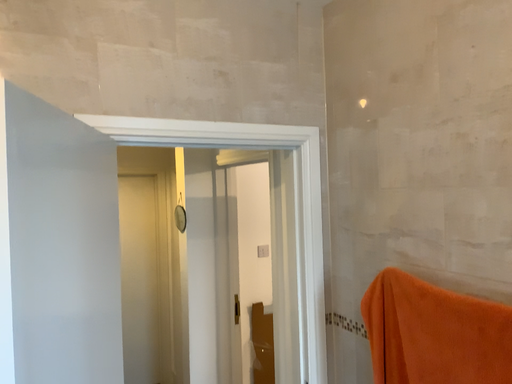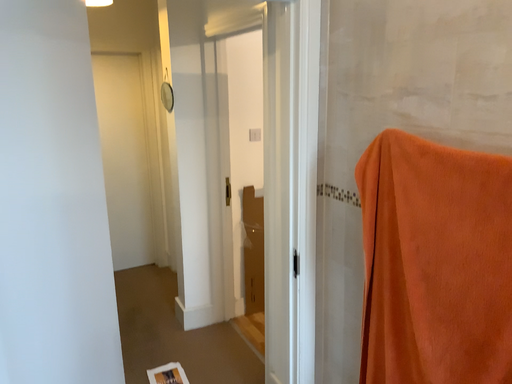
Question: Which way did the camera rotate in the video?

Choices:
 (A) rotated upward
 (B) rotated downward

Answer: (B)